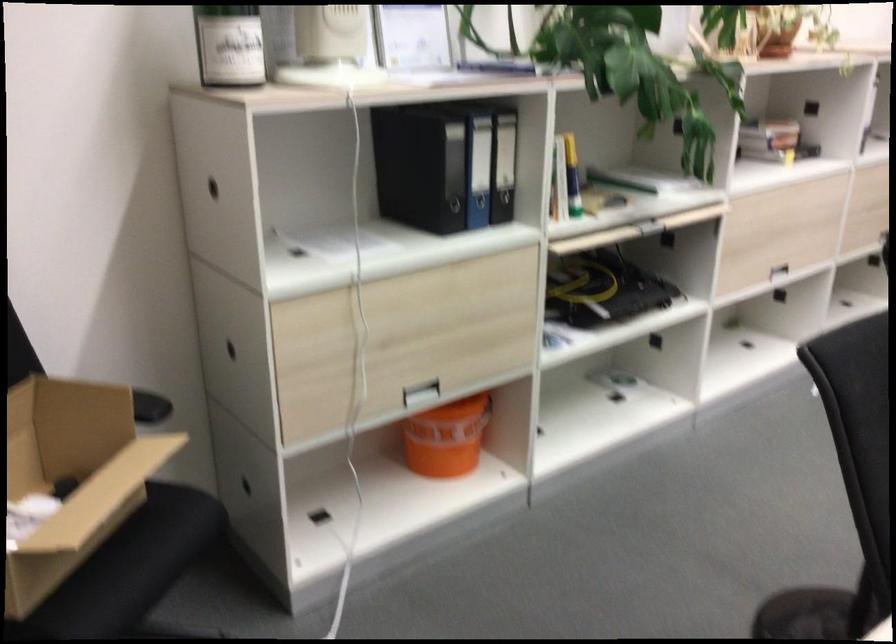
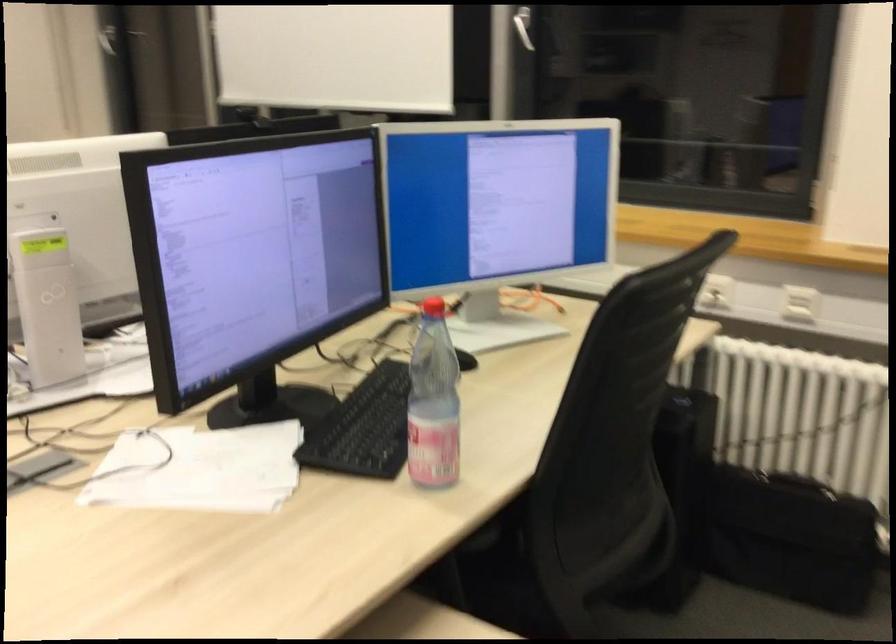
Question: The images are taken continuously from a first-person perspective. In which direction are you moving?

Choices:
 (A) Left
 (B) Right
 (C) Forward
 (D) Backward

Answer: (B)